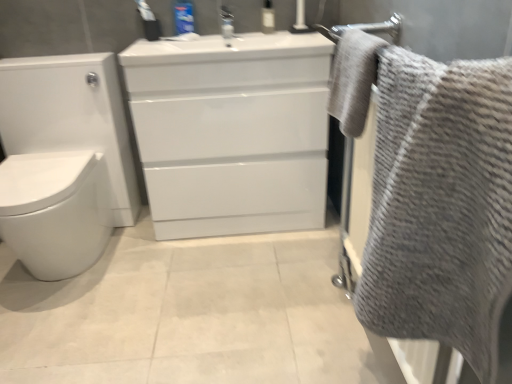
Identify the location of empty space that is to the right of transparent plastic bottle at upper center, the second toiletry positioned from the left. click(301, 29).